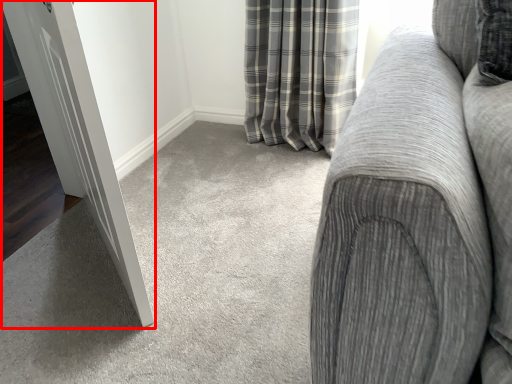
Question: From the image's perspective, considering the relative positions of door (annotated by the red box) and studio couch in the image provided, where is door (annotated by the red box) located with respect to the staircase?

Choices:
 (A) above
 (B) below

Answer: (B)